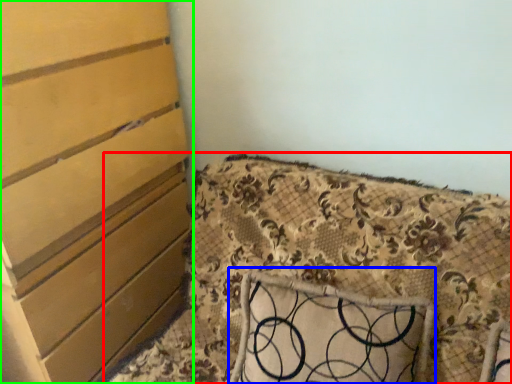
Question: Estimate the real-world distances between objects in this image. Which object is farther from furniture (highlighted by a red box), pillow (highlighted by a blue box) or chest of drawers (highlighted by a green box)?

Choices:
 (A) pillow
 (B) chest of drawers

Answer: (B)